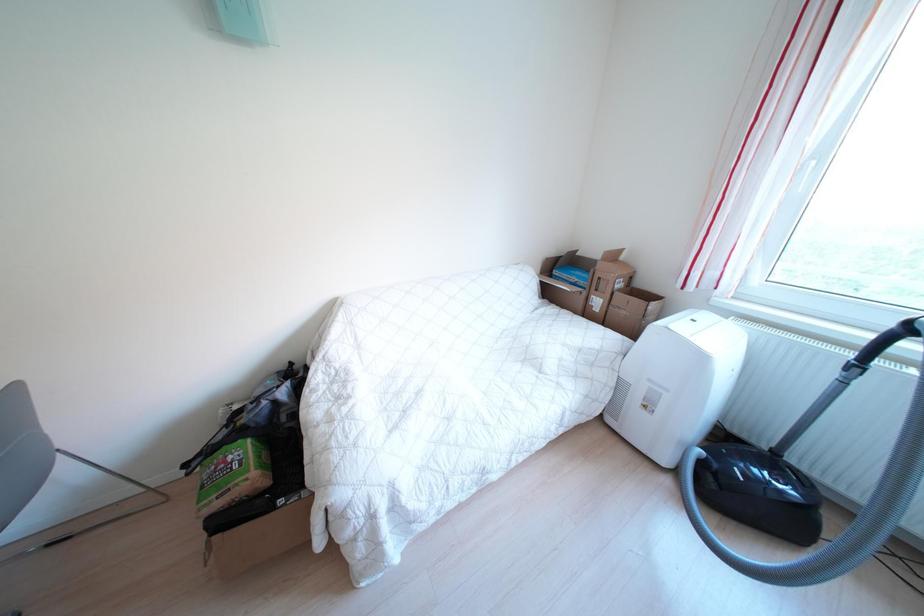
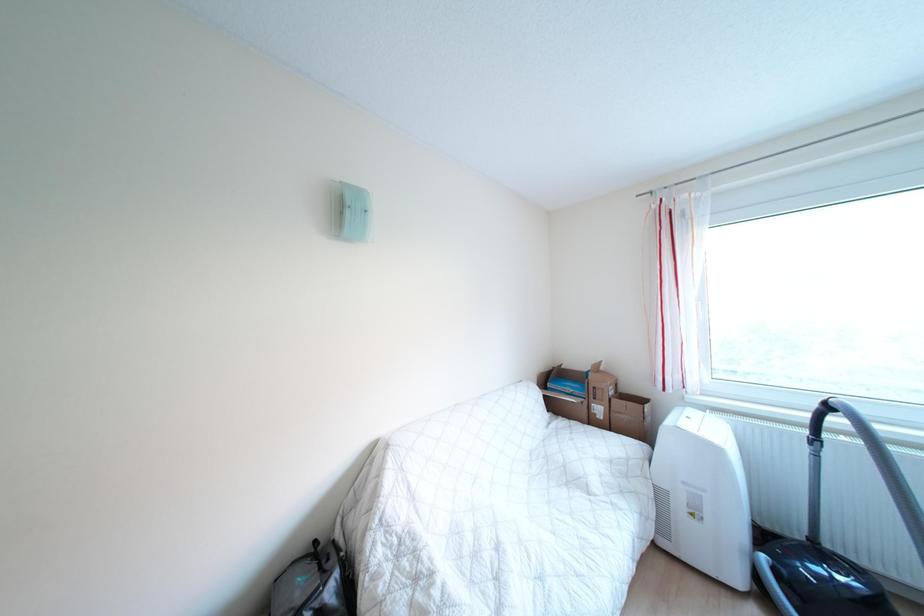
Question: How did the camera likely rotate?

Choices:
 (A) Left
 (B) Right
 (C) Up
 (D) Down

Answer: (C)